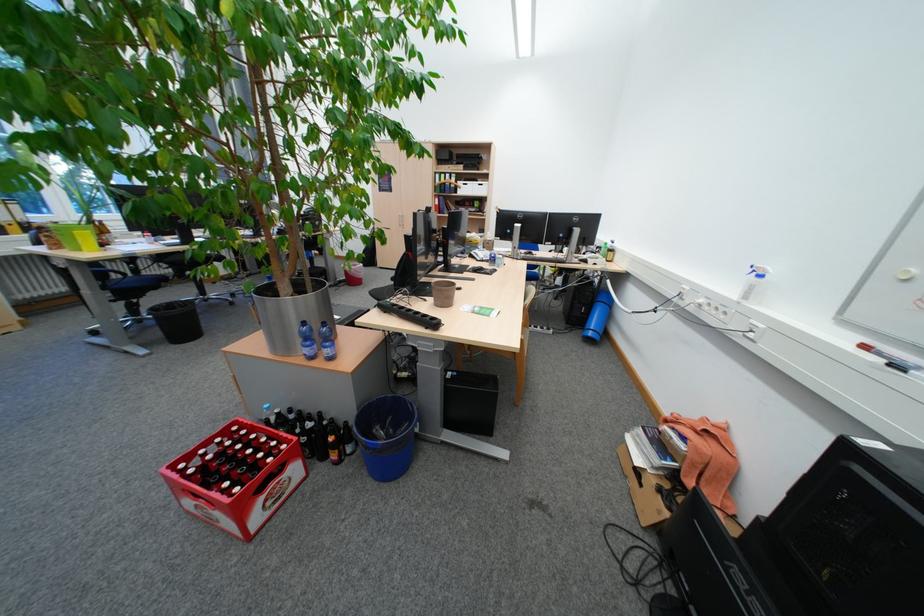
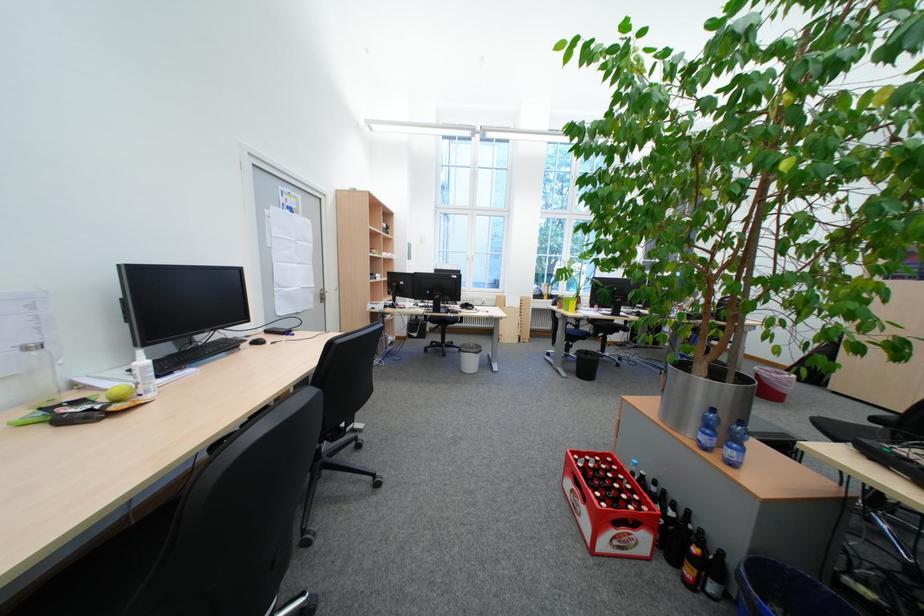
In the second image, find the point that corresponds to the point at 338,352 in the first image.

(743, 454)